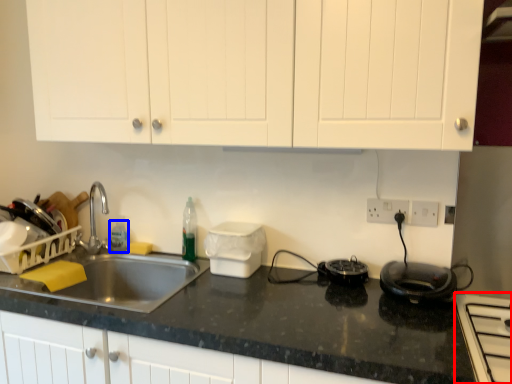
Question: Among these objects, which one is farthest to the camera, home appliance (highlighted by a red box) or bottle (highlighted by a blue box)?

Choices:
 (A) home appliance
 (B) bottle

Answer: (B)